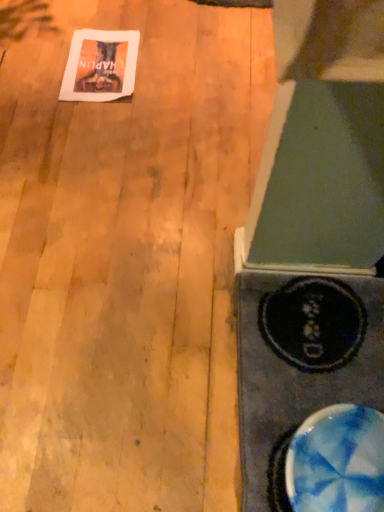
Identify the location of free area in between blue marbled bowl at lower right and white paper at upper left. This screenshot has width=384, height=512. (163, 192).